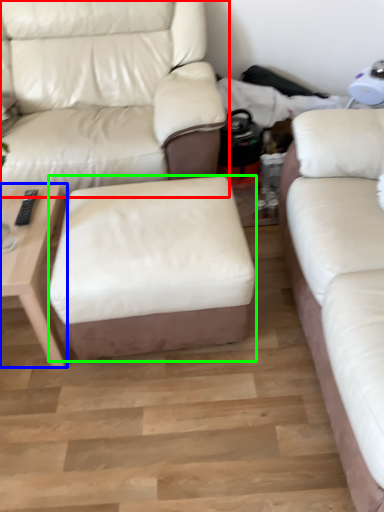
Question: Based on their relative distances, which object is nearer to studio couch (highlighted by a red box)? Choose from table (highlighted by a blue box) and stool (highlighted by a green box).

Choices:
 (A) table
 (B) stool

Answer: (B)